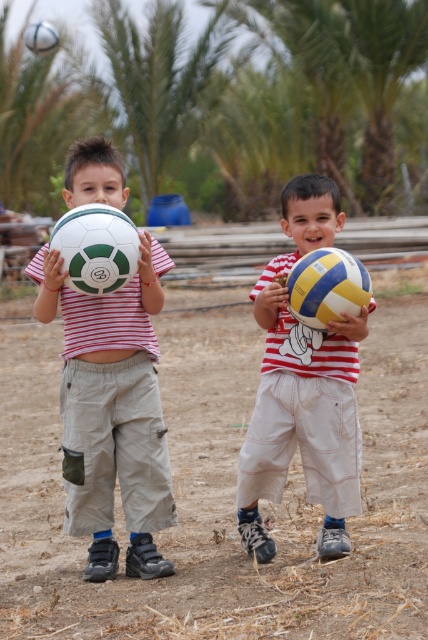
Can you confirm if yellow and blue textured volleyball at center is shorter than white matte soccer ball at upper left?

Correct, yellow and blue textured volleyball at center is not as tall as white matte soccer ball at upper left.

Does point (324, 323) come farther from viewer compared to point (35, 24)?

No, (324, 323) is in front of (35, 24).

Who is more distant from viewer, (363, 276) or (50, 36)?

The point (50, 36) is behind.

Image resolution: width=428 pixels, height=640 pixels. Identify the location of yellow and blue textured volleyball at center. (326, 285).

Based on the photo, between brown dirt field at center and matte green and white soccer ball at left, which one appears on the right side from the viewer's perspective?

From the viewer's perspective, matte green and white soccer ball at left appears more on the right side.

Which is more to the left, brown dirt field at center or matte green and white soccer ball at left?

From the viewer's perspective, brown dirt field at center appears more on the left side.

Is point (308, 525) more distant than point (48, 294)?

Yes.

Locate an element on the screen. brown dirt field at center is located at coordinates (223, 492).

Between point (256, 308) and point (50, 38), which one is positioned behind?

Positioned behind is point (50, 38).

Between matte yellow and blue volleyball at center and white matte soccer ball at upper left, which one appears on the left side from the viewer's perspective?

white matte soccer ball at upper left is more to the left.

At what (x,y) coordinates should I click in order to perform the action: click on matte yellow and blue volleyball at center. Please return your answer as a coordinate pair (x, y). Looking at the image, I should click on (303, 388).